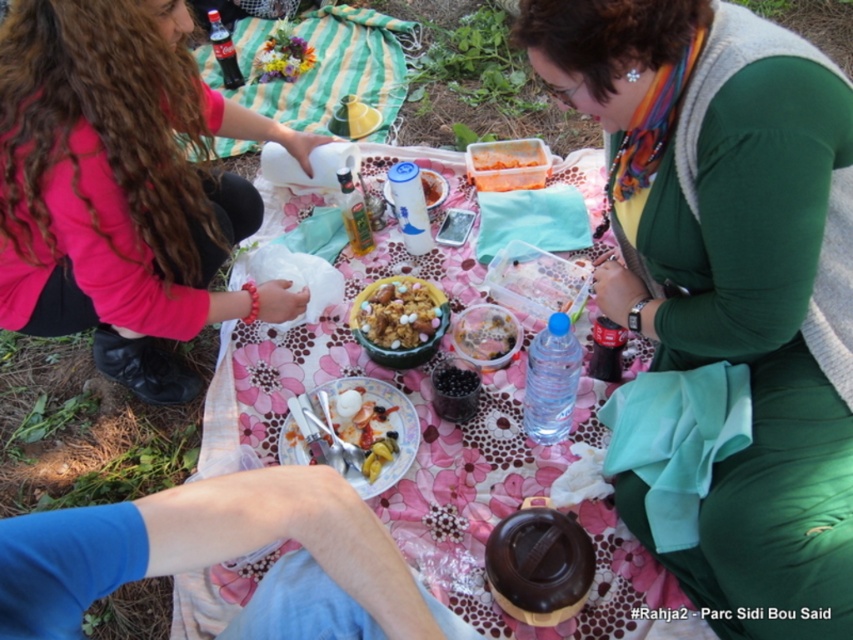
Question: Can you confirm if matte pink sweater at upper left is thinner than crumbly brownie at center?

Choices:
 (A) yes
 (B) no

Answer: (B)

Question: Which object appears farthest from the camera in this image?

Choices:
 (A) green striped blanket at upper center
 (B) pink floral cloth at center

Answer: (A)

Question: Which point appears farthest from the camera in this image?

Choices:
 (A) (392, 205)
 (B) (77, 234)
 (C) (167, 512)

Answer: (A)

Question: Which object is positioned farthest from the matte pink sweater at upper left?

Choices:
 (A) crumbly brownie at center
 (B) green matte dress at center
 (C) blue denim jeans at lower left

Answer: (B)

Question: From the image, what is the correct spatial relationship of translucent plastic container at center in relation to white plastic container at center?

Choices:
 (A) above
 (B) below

Answer: (A)

Question: Can you confirm if matte pink sweater at upper left is positioned to the right of blue denim jeans at lower left?

Choices:
 (A) no
 (B) yes

Answer: (A)